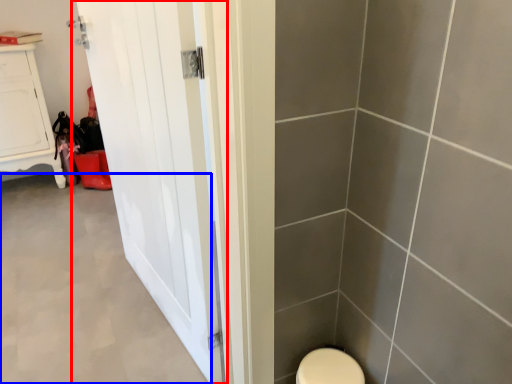
Question: Among these objects, which one is nearest to the camera, door (highlighted by a red box) or plain (highlighted by a blue box)?

Choices:
 (A) door
 (B) plain

Answer: (A)